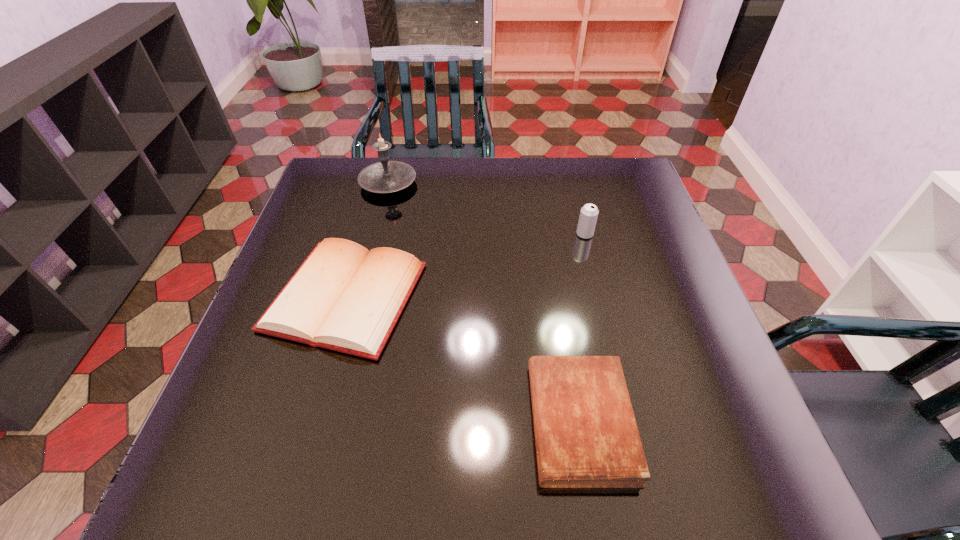
At what (x,y) coordinates should I click in order to perform the action: click on vacant region that satisfies the following two spatial constraints: 1. on the front side of the farthest object; 2. on the left side of the third nearest object. Please return your answer as a coordinate pair (x, y). Looking at the image, I should click on (375, 234).